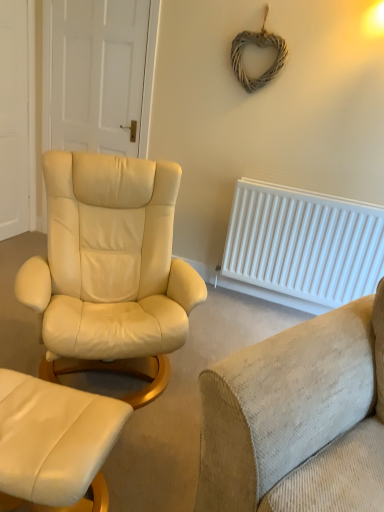
Question: Considering the positions of point [82, 508] and point [135, 68], is point [82, 508] closer or farther from the camera than point [135, 68]?

Choices:
 (A) closer
 (B) farther

Answer: (A)

Question: From their relative heights in the image, would you say matte cream leather ottoman at lower left is taller or shorter than white matte door at upper left, arranged as the second door when viewed from the left?

Choices:
 (A) tall
 (B) short

Answer: (B)

Question: Which object is positioned closest to the white plastic radiator at right?

Choices:
 (A) matte cream leather ottoman at lower left
 (B) beige corduroy couch at lower right
 (C) white wooden door at left, acting as the second door starting from the right
 (D) white matte door at upper left, which is the 1th door in right-to-left order

Answer: (D)

Question: Which is nearer to the beige corduroy couch at lower right?

Choices:
 (A) white wooden door at left, acting as the second door starting from the right
 (B) matte cream leather ottoman at lower left
 (C) white matte door at upper left, which is the 1th door in right-to-left order
 (D) white plastic radiator at right

Answer: (B)